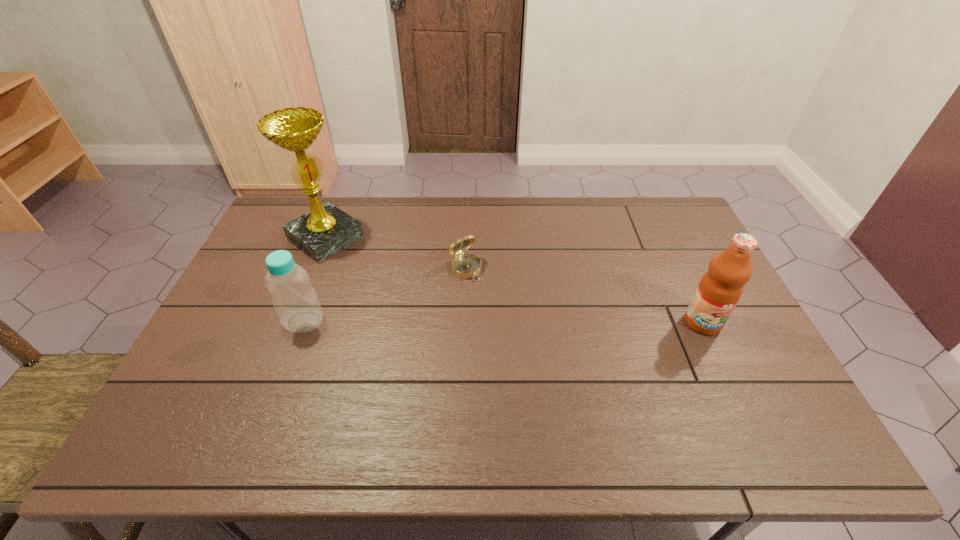
Locate an element on the screen. The image size is (960, 540). free space on the desktop that is between the second shortest object and the rightmost object and is positioned with the dial facing the compass is located at coordinates (511, 322).

Find the location of a particular element. The width and height of the screenshot is (960, 540). free space on the desktop that is between the second shortest object and the second tallest object and is positioned on the front-facing side of the award is located at coordinates (444, 322).